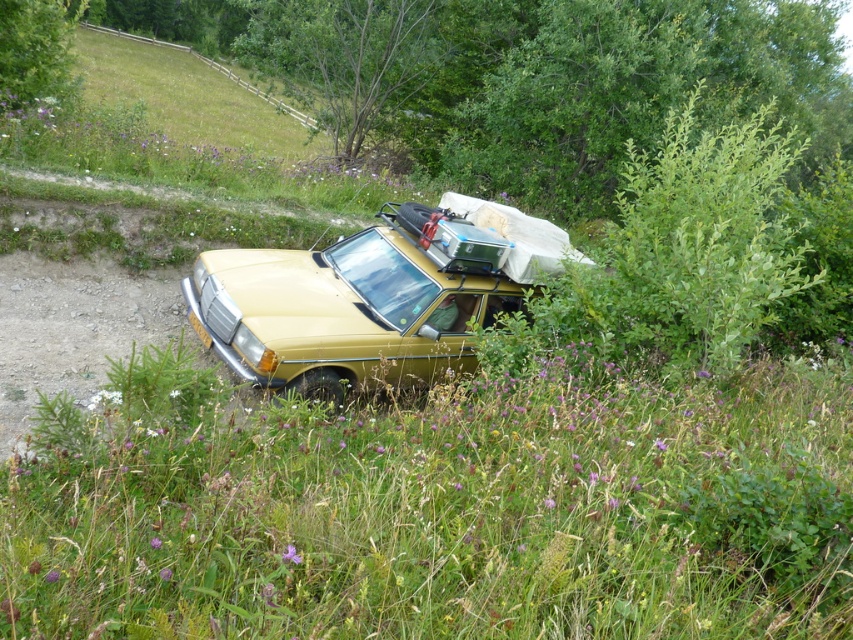
Question: Does green grass at center have a lesser width compared to matte gold car at center?

Choices:
 (A) yes
 (B) no

Answer: (B)

Question: Can you confirm if green grass at center is bigger than matte gold car at center?

Choices:
 (A) yes
 (B) no

Answer: (A)

Question: Does green grass at center appear under matte gold car at center?

Choices:
 (A) yes
 (B) no

Answer: (A)

Question: Which point is closer to the camera taking this photo?

Choices:
 (A) (212, 300)
 (B) (274, 476)

Answer: (B)